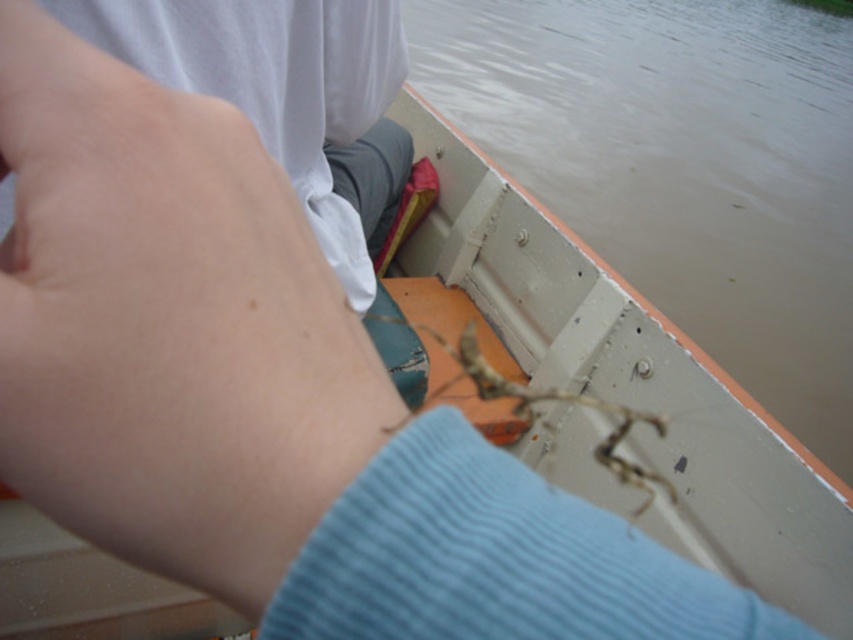
You are standing on the deck of the boat and want to reach the point at coordinates point (287, 339). If your arm is 24 inches long, can you comfortably reach that point?

The point (287, 339) is 6.95 inches from the camera, and your arm is 24 inches long, so yes, you can comfortably reach it.

You are a photographer trying to capture the skinny flesh at center and the muddy water at upper right in the same frame. Based on their sizes, which object should you focus on first to ensure both are in focus?

The skinny flesh at center is smaller than the muddy water at upper right, so you should focus on the muddy water at upper right first since it is larger and will require more attention to capture details.

You are navigating a small boat and want to avoid hitting the muddy water at upper right. Based on your current position, which direction should you steer to avoid it?

The muddy water at upper right is located at point (682,164), so you should steer left to avoid it.